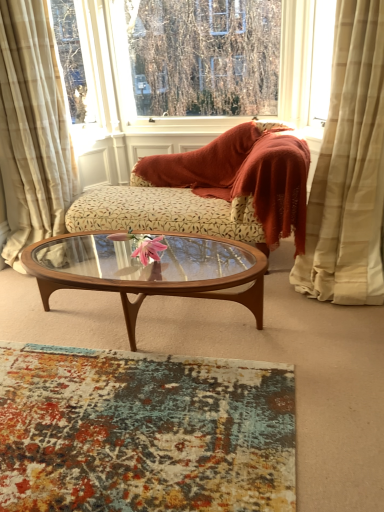
Question: Is there a large distance between beige textured curtain at right, arranged as the 2th curtain when viewed from the left, and beige plaid curtain at left, the 1th curtain positioned from the left?

Choices:
 (A) yes
 (B) no

Answer: (A)

Question: From a real-world perspective, is beige textured curtain at right, arranged as the 2th curtain when viewed from the left, below beige plaid curtain at left, the 1th curtain positioned from the left?

Choices:
 (A) no
 (B) yes

Answer: (A)

Question: Considering the relative sizes of beige textured curtain at right, arranged as the 2th curtain when viewed from the left, and beige plaid curtain at left, the second curtain viewed from the right, in the image provided, is beige textured curtain at right, arranged as the 2th curtain when viewed from the left, shorter than beige plaid curtain at left, the second curtain viewed from the right,?

Choices:
 (A) no
 (B) yes

Answer: (B)

Question: Can you confirm if beige textured curtain at right, which is the 1th curtain in right-to-left order, is wider than beige plaid curtain at left, the second curtain viewed from the right?

Choices:
 (A) yes
 (B) no

Answer: (B)

Question: Is beige textured curtain at right, which is the 1th curtain in right-to-left order, not within beige plaid curtain at left, the 1th curtain positioned from the left?

Choices:
 (A) no
 (B) yes

Answer: (B)

Question: Is transparent glass window at upper center taller or shorter than floral-patterned fabric couch at center?

Choices:
 (A) tall
 (B) short

Answer: (A)

Question: From a real-world perspective, is transparent glass window at upper center above or below floral-patterned fabric couch at center?

Choices:
 (A) below
 (B) above

Answer: (B)

Question: Would you say transparent glass window at upper center is to the left or to the right of floral-patterned fabric couch at center in the picture?

Choices:
 (A) right
 (B) left

Answer: (B)

Question: Relative to floral-patterned fabric couch at center, is transparent glass window at upper center in front or behind?

Choices:
 (A) behind
 (B) front

Answer: (A)

Question: Considering the positions of wooden glass coffee table at center and floral-patterned fabric couch at center in the image, is wooden glass coffee table at center taller or shorter than floral-patterned fabric couch at center?

Choices:
 (A) tall
 (B) short

Answer: (B)

Question: Based on their sizes in the image, would you say wooden glass coffee table at center is bigger or smaller than floral-patterned fabric couch at center?

Choices:
 (A) big
 (B) small

Answer: (B)

Question: Looking at their shapes, would you say wooden glass coffee table at center is wider or thinner than floral-patterned fabric couch at center?

Choices:
 (A) wide
 (B) thin

Answer: (B)

Question: Is wooden glass coffee table at center inside the boundaries of floral-patterned fabric couch at center, or outside?

Choices:
 (A) inside
 (B) outside

Answer: (B)

Question: Looking at their shapes, would you say floral-patterned fabric couch at center is wider or thinner than wooden glass coffee table at center?

Choices:
 (A) wide
 (B) thin

Answer: (A)

Question: From a real-world perspective, relative to wooden glass coffee table at center, is floral-patterned fabric couch at center vertically above or below?

Choices:
 (A) above
 (B) below

Answer: (A)